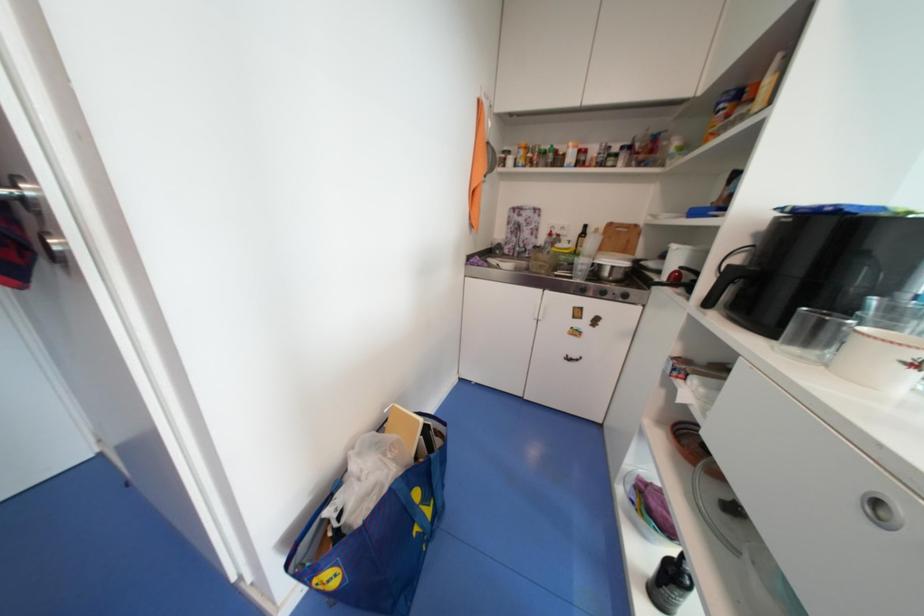
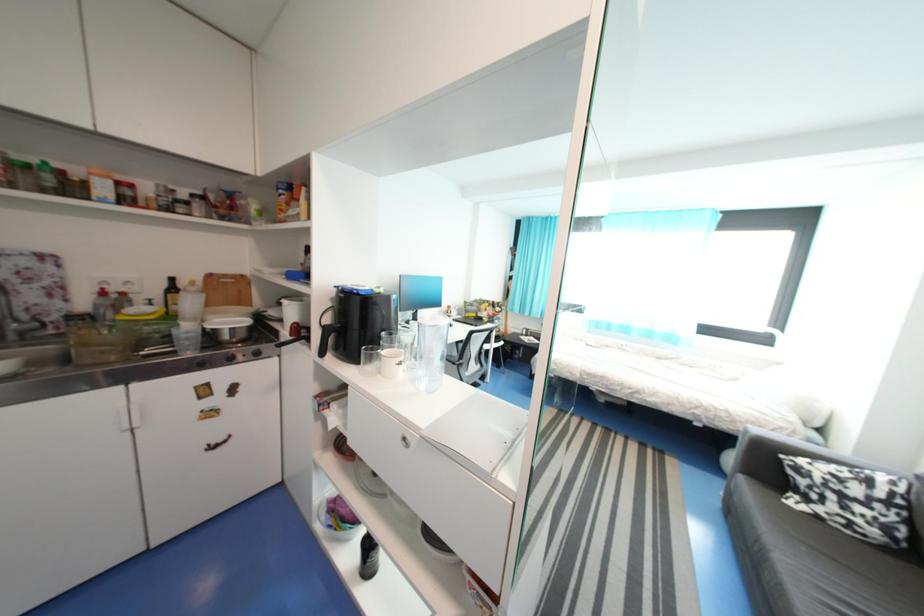
Question: The first image is from the beginning of the video and the second image is from the end. How did the camera likely rotate when shooting the video?

Choices:
 (A) Left
 (B) Right
 (C) Up
 (D) Down

Answer: (B)